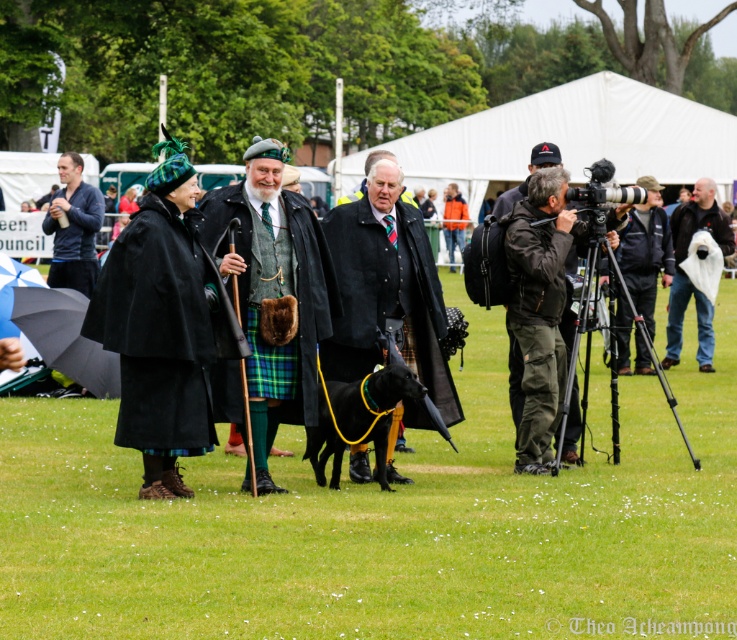
Question: Is green woolen kilt at center smaller than black fabric camera at right?

Choices:
 (A) yes
 (B) no

Answer: (B)

Question: Among these objects, which one is farthest from the camera?

Choices:
 (A) black woolen robe at center
 (B) green woolen kilt at center
 (C) black fabric camera at right
 (D) white fabric tent at upper center

Answer: (D)

Question: Which point appears closest to the camera in this image?

Choices:
 (A) (324, 269)
 (B) (73, 218)
 (C) (97, 308)
 (D) (681, 120)

Answer: (C)

Question: Can you confirm if white fabric bag at right is positioned to the left of matte blue jacket at left?

Choices:
 (A) no
 (B) yes

Answer: (A)

Question: Is green woolen kilt at center smaller than black woolen robe at center?

Choices:
 (A) no
 (B) yes

Answer: (A)

Question: Which point is farther from the camera taking this photo?

Choices:
 (A) (663, 227)
 (B) (170, 442)
 (C) (394, 324)

Answer: (A)